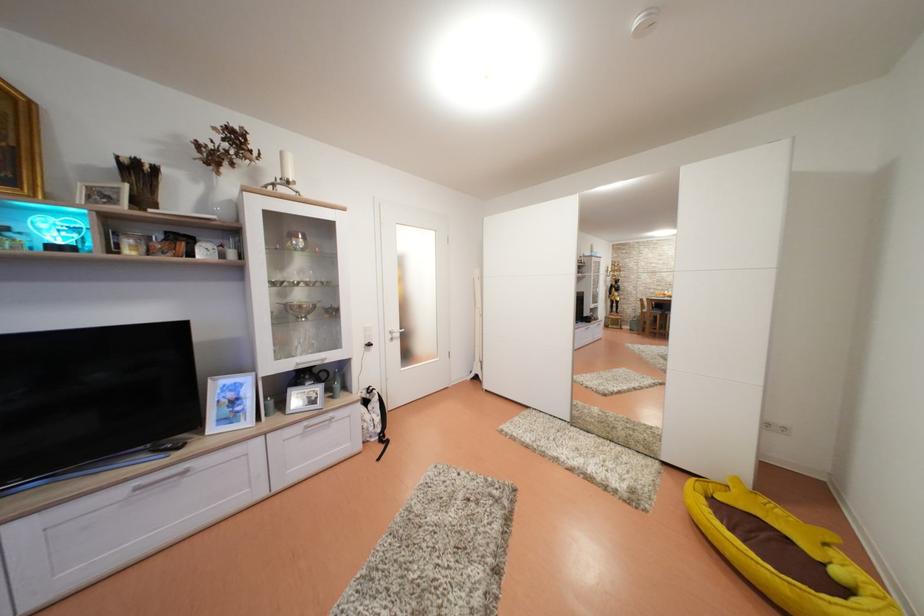
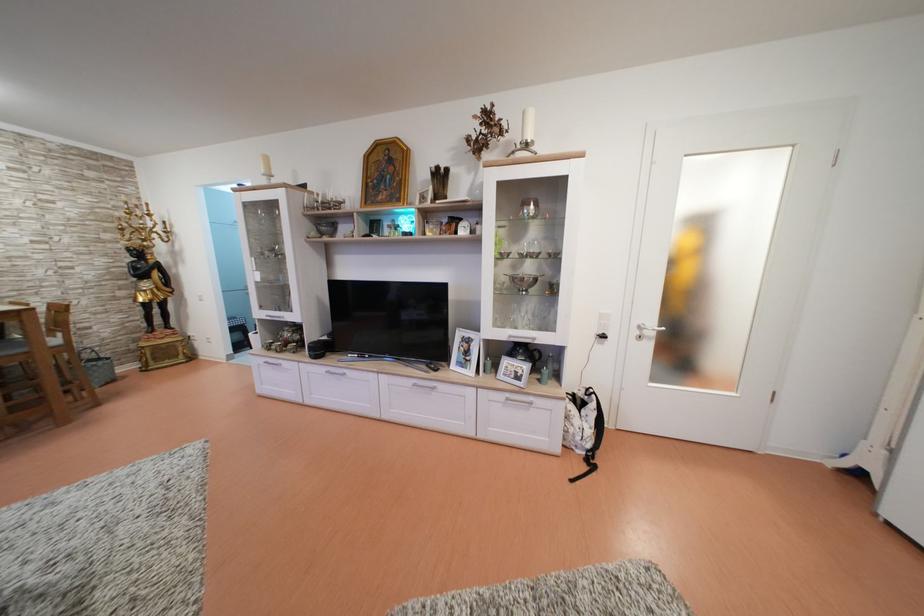
Find the pixel in the second image that matches pixel 397 338 in the first image.

(647, 333)